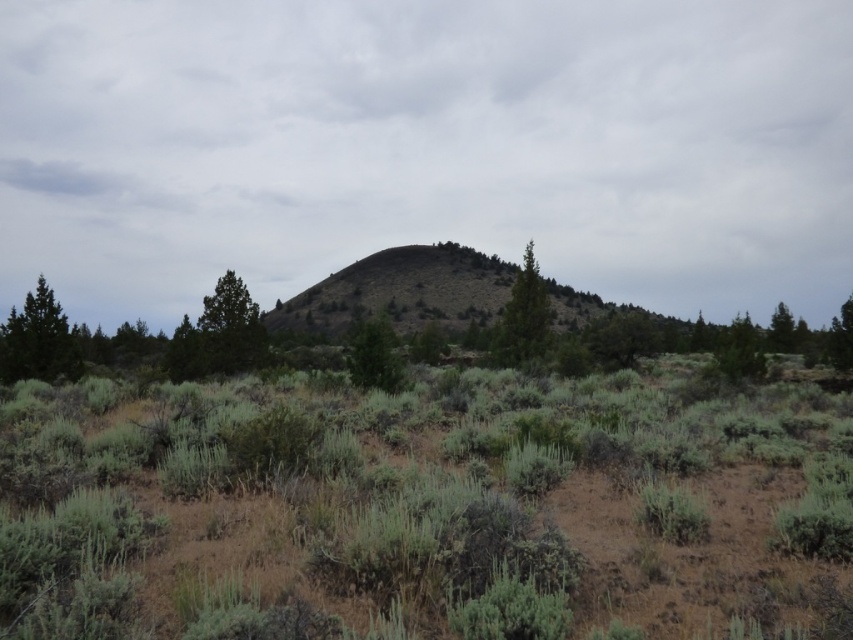
Does point (482, 305) lie in front of point (749, 330)?

No, it is not.

Can you confirm if green grassy hill at center is bigger than green matte tree at right?

Yes, green grassy hill at center is bigger than green matte tree at right.

Is point (396, 259) closer to camera compared to point (734, 368)?

No.

Find the location of `green grassy hill at center`. green grassy hill at center is located at coordinates (399, 292).

Is green leafy tree at center to the left of green textured tree at right from the viewer's perspective?

Indeed, green leafy tree at center is positioned on the left side of green textured tree at right.

Find the location of a particular element. Image resolution: width=853 pixels, height=640 pixels. green leafy tree at center is located at coordinates (374, 356).

Between green textured tree at upper center and green textured tree at right, which one has more height?

green textured tree at upper center is taller.

Who is more forward, (527, 316) or (785, 330)?

Point (527, 316) is more forward.

I want to click on green textured tree at upper center, so coord(523,316).